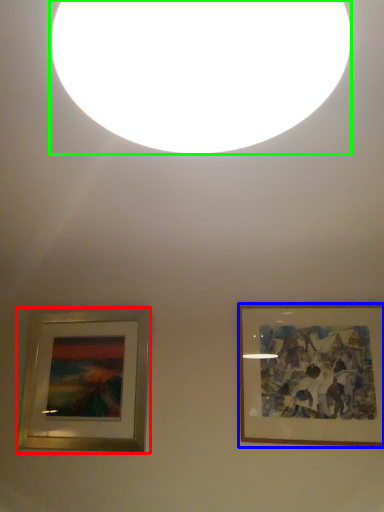
Question: Which object is the farthest from picture frame (highlighted by a red box)? Choose among these: picture frame (highlighted by a blue box) or lighting (highlighted by a green box).

Choices:
 (A) picture frame
 (B) lighting

Answer: (B)